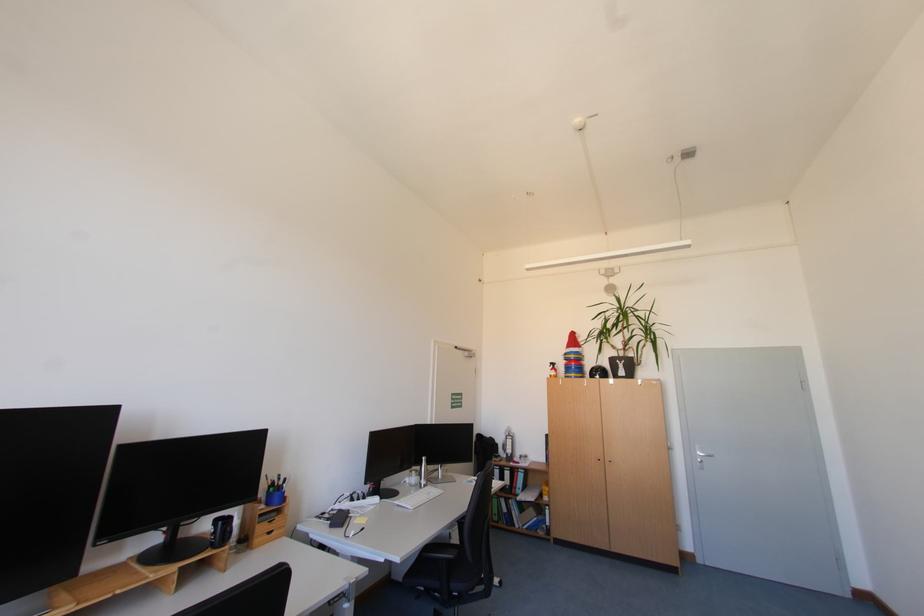
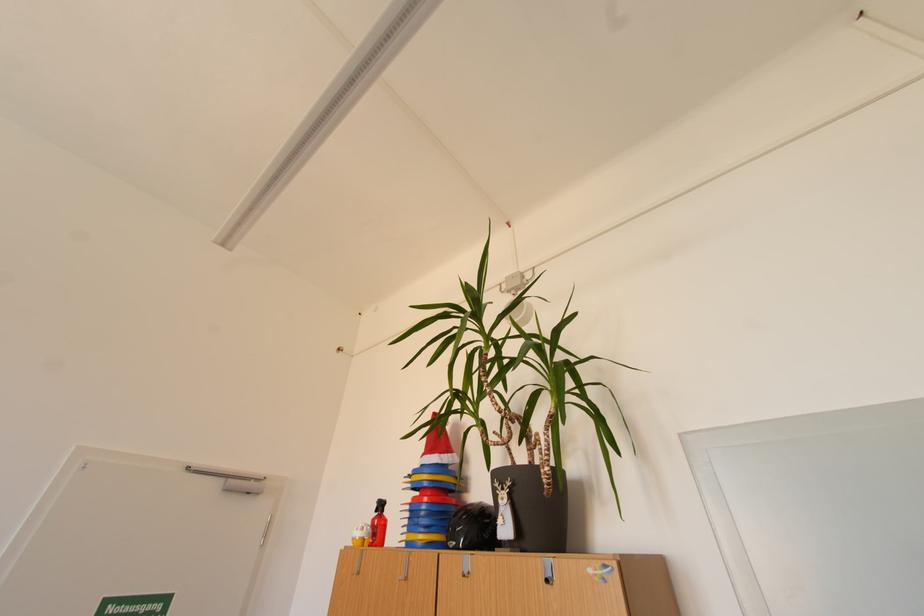
The point at (630, 363) is marked in the first image. Where is the corresponding point in the second image?

(517, 485)